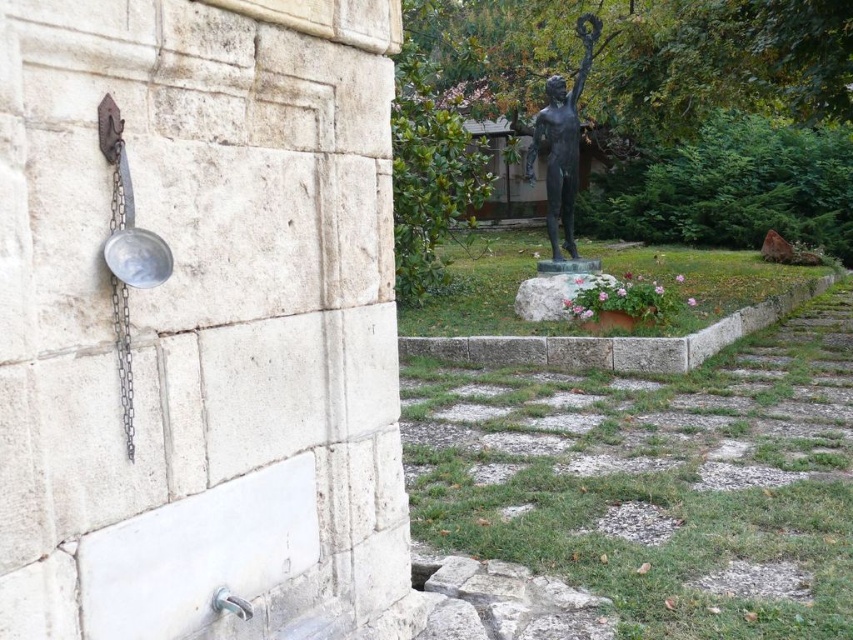
Question: Which object appears closest to the camera in this image?

Choices:
 (A) bronze statue at center
 (B) white stone at center

Answer: (B)

Question: Does bronze statue at center have a larger size compared to white stone at center?

Choices:
 (A) yes
 (B) no

Answer: (A)

Question: Can you confirm if bronze statue at center is bigger than white stone at center?

Choices:
 (A) no
 (B) yes

Answer: (B)

Question: Does bronze statue at center appear on the right side of white stone at center?

Choices:
 (A) no
 (B) yes

Answer: (B)

Question: Which point is farther to the camera?

Choices:
 (A) coord(547,131)
 (B) coord(524,285)

Answer: (A)

Question: Which point is closer to the camera taking this photo?

Choices:
 (A) (532, 316)
 (B) (590, 45)

Answer: (A)